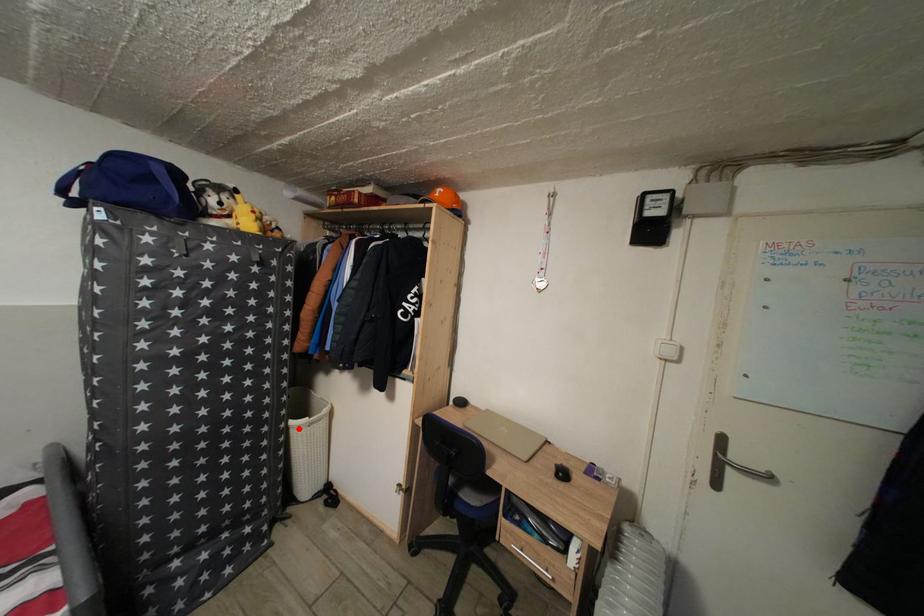
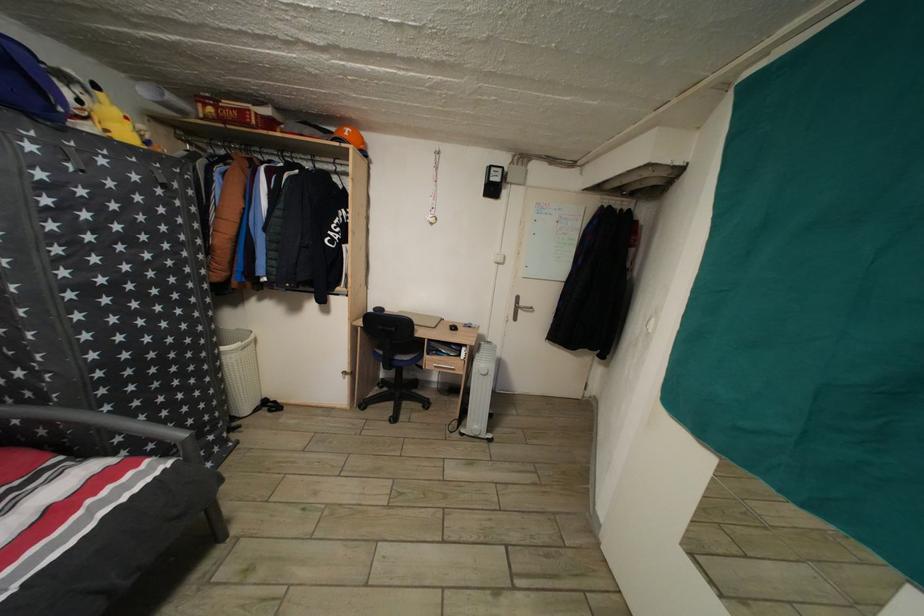
In the second image, find the point that corresponds to the highlighted location in the first image.

(229, 355)